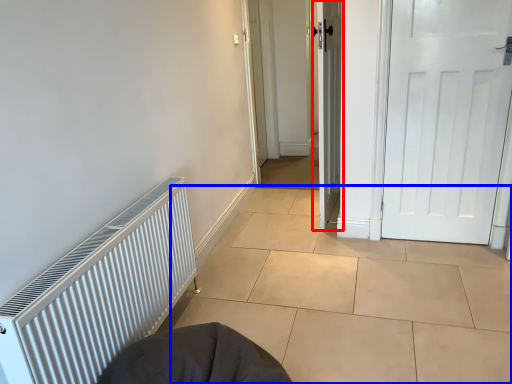
Question: Which object is further to the camera taking this photo, door (highlighted by a red box) or tile (highlighted by a blue box)?

Choices:
 (A) door
 (B) tile

Answer: (A)